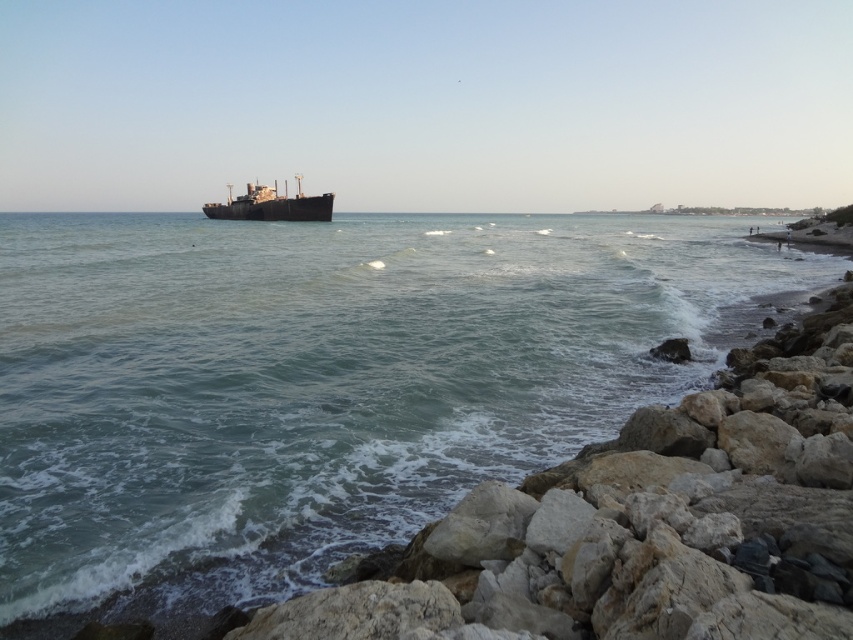
Which of these two, greenish-blue water at center or rusty metal ship at center, stands shorter?

rusty metal ship at center

Describe the element at coordinates (322, 381) in the screenshot. I see `greenish-blue water at center` at that location.

Which is behind, point (560, 266) or point (317, 208)?

Positioned behind is point (317, 208).

What are the coordinates of `greenish-blue water at center` in the screenshot? It's located at (322, 381).